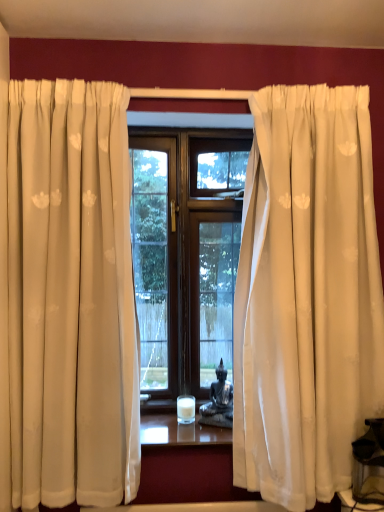
The height and width of the screenshot is (512, 384). In order to click on white wax candle at center in this screenshot , I will do `click(185, 409)`.

What do you see at coordinates (185, 409) in the screenshot? I see `white wax candle at center` at bounding box center [185, 409].

Image resolution: width=384 pixels, height=512 pixels. What are the coordinates of `white wax candle at center` in the screenshot? It's located at (185, 409).